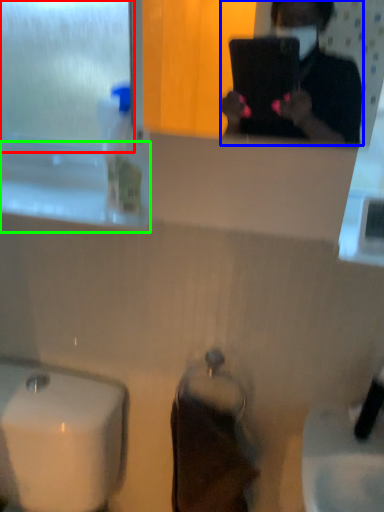
Question: Estimate the real-world distances between objects in this image. Which object is farther from window screen (highlighted by a red box), person (highlighted by a blue box) or window sill (highlighted by a green box)?

Choices:
 (A) person
 (B) window sill

Answer: (A)